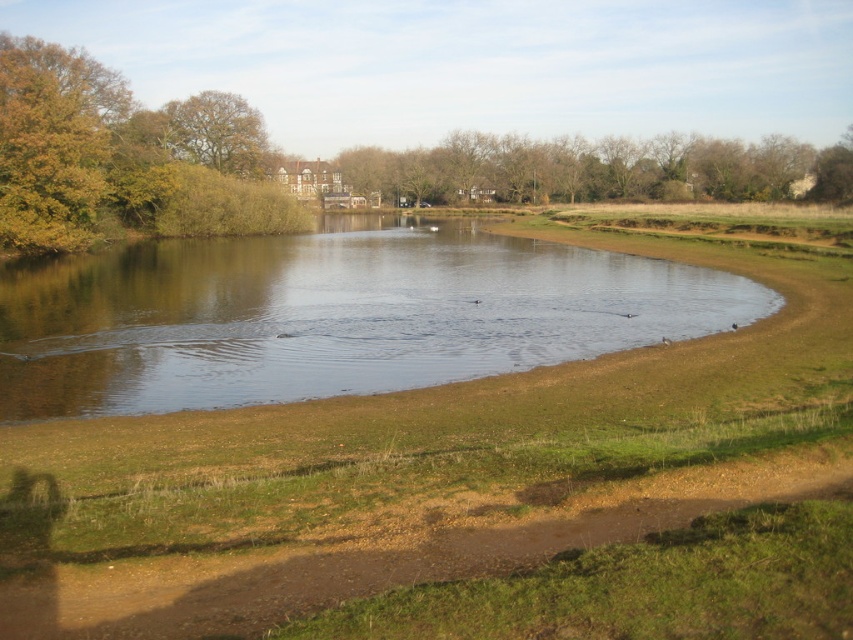
Question: Does brown leafy trees at upper center have a larger size compared to brown leafy tree at upper left?

Choices:
 (A) yes
 (B) no

Answer: (A)

Question: Can you confirm if brown grassy lake at center is positioned below brown leafy tree at upper left?

Choices:
 (A) no
 (B) yes

Answer: (B)

Question: Is brown leafy trees at upper center below brown leafy tree at upper left?

Choices:
 (A) yes
 (B) no

Answer: (B)

Question: Among these points, which one is nearest to the camera?

Choices:
 (A) (158, 321)
 (B) (144, 228)
 (C) (527, 179)

Answer: (A)

Question: Which point is closer to the camera taking this photo?

Choices:
 (A) (399, 156)
 (B) (218, 129)

Answer: (B)

Question: Which of the following is the closest to the observer?

Choices:
 (A) brown leafy tree at upper left
 (B) brown grassy lake at center
 (C) green grass at center

Answer: (C)